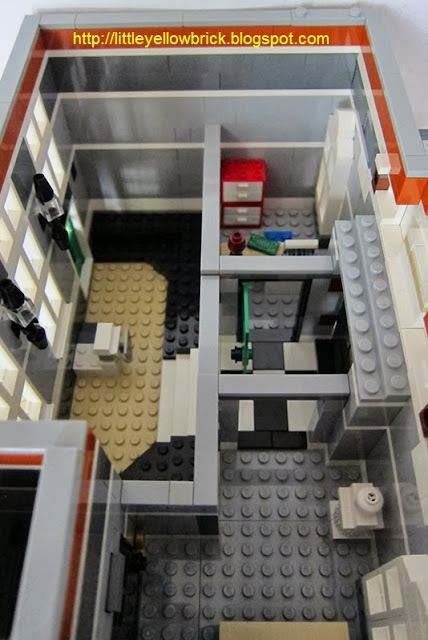
The image size is (428, 640). I want to click on furthest arched window, so click(335, 175).